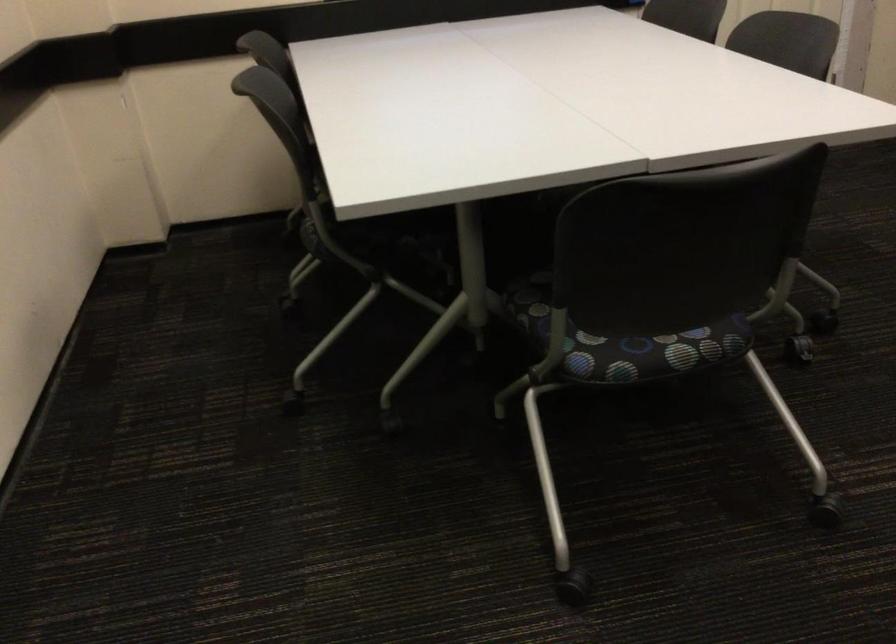
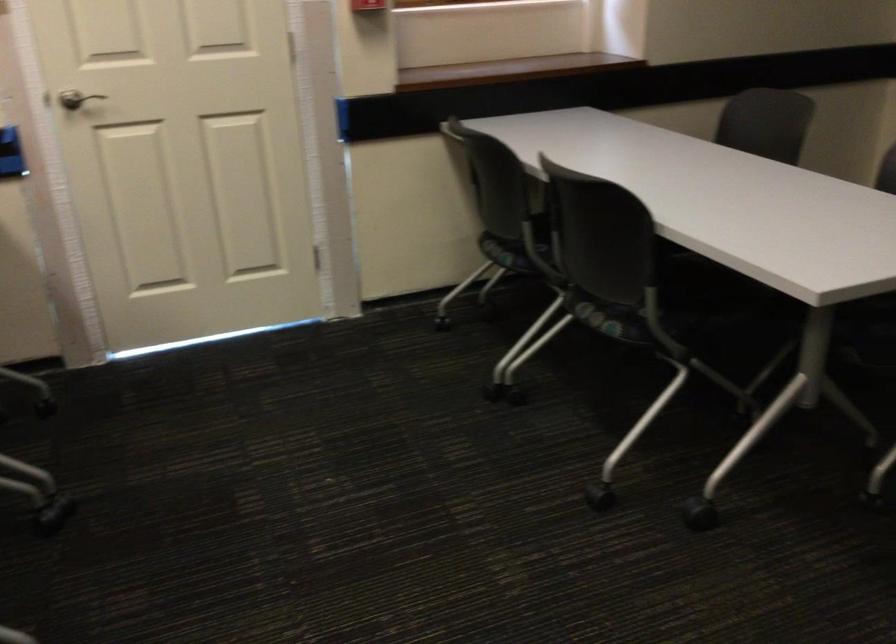
Question: Which direction would the cameraman need to move to produce the second image? Reply with the corresponding letter.

Choices:
 (A) Left
 (B) Right
 (C) Forward
 (D) Backward

Answer: (B)